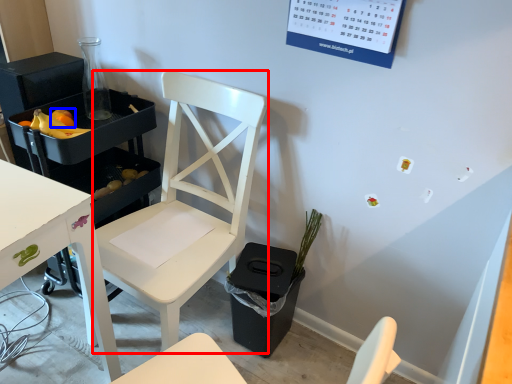
Question: Which object appears closest to the camera in this image, chair (highlighted by a red box) or fruit (highlighted by a blue box)?

Choices:
 (A) chair
 (B) fruit

Answer: (A)